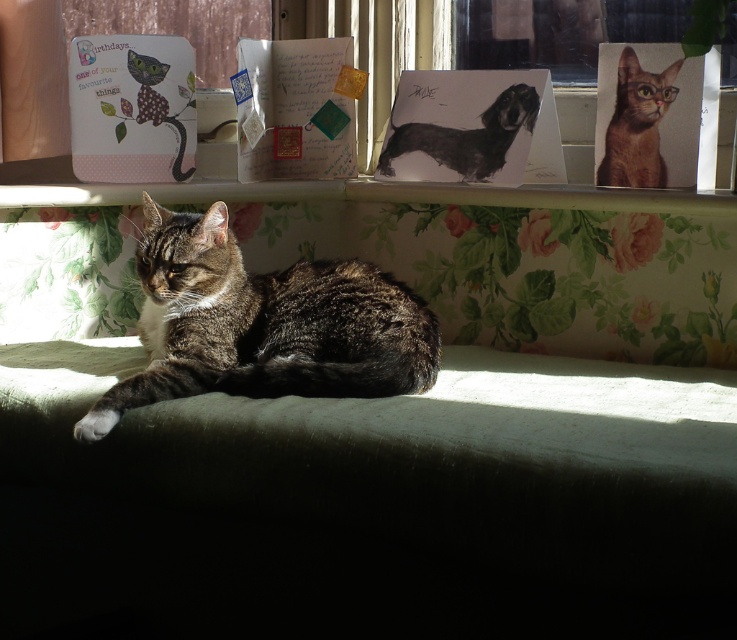
Question: Is transparent glass window at upper center smaller than black glossy dog at upper center?

Choices:
 (A) yes
 (B) no

Answer: (B)

Question: Can you confirm if white glossy paper at upper center is bigger than transparent glass window at upper center?

Choices:
 (A) yes
 (B) no

Answer: (A)

Question: Estimate the real-world distances between objects in this image. Which object is farther from the tabby fur cat at center?

Choices:
 (A) black glossy dog at upper center
 (B) brown glossy cat at upper right
 (C) green fabric couch at lower center

Answer: (B)

Question: Is green fabric couch at lower center wider than brown glossy cat at upper right?

Choices:
 (A) no
 (B) yes

Answer: (B)

Question: Which is nearer to the green fabric couch at lower center?

Choices:
 (A) black glossy dog at upper center
 (B) tabby fur cat at center
 (C) white glossy paper at upper center
 (D) brown glossy cat at upper right

Answer: (B)

Question: Which point appears closest to the camera in this image?

Choices:
 (A) pyautogui.click(x=677, y=1)
 (B) pyautogui.click(x=447, y=320)

Answer: (B)